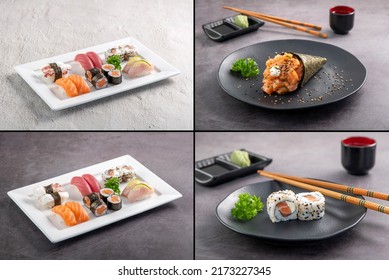
You are a GUI agent. You are given a task and a screenshot of the screen. Output one action in this format:
    pyautogui.click(x=<x>, y=<y>)
    Task: Click on the black cup
    The image size is (389, 280).
    Given the screenshot: What is the action you would take?
    pyautogui.click(x=369, y=153)